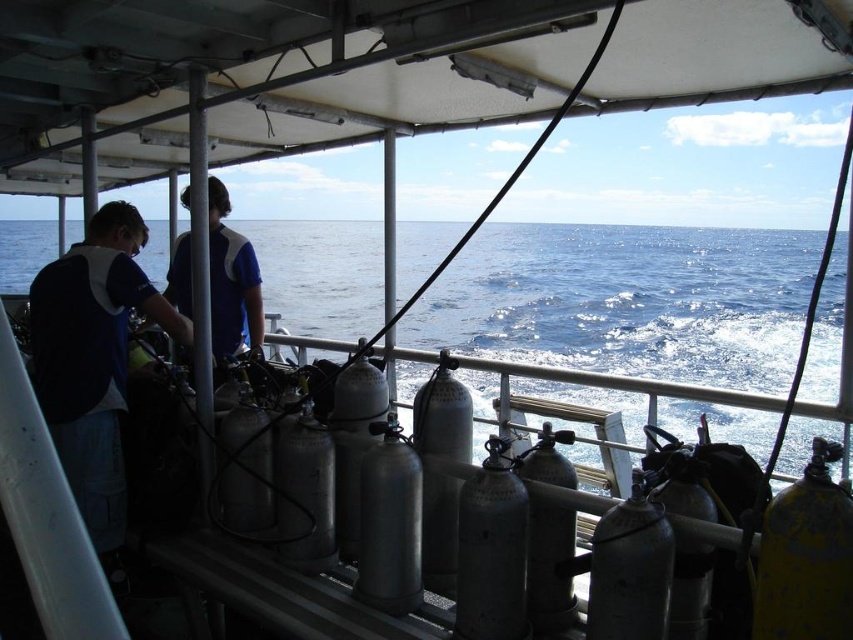
Question: Is dark blue shirt at left wider than blue fabric shirt at center?

Choices:
 (A) no
 (B) yes

Answer: (B)

Question: Does metallic silver water at lower center have a smaller size compared to blue fabric shirt at center?

Choices:
 (A) no
 (B) yes

Answer: (A)

Question: Is dark blue shirt at left positioned in front of blue fabric shirt at center?

Choices:
 (A) no
 (B) yes

Answer: (B)

Question: Which object is positioned farthest from the dark blue shirt at left?

Choices:
 (A) metallic silver water at lower center
 (B) blue fabric shirt at center

Answer: (A)

Question: Which object appears closest to the camera in this image?

Choices:
 (A) dark blue shirt at left
 (B) blue fabric shirt at center
 (C) metallic silver water at lower center

Answer: (C)

Question: Which of the following is the farthest from the observer?

Choices:
 (A) dark blue shirt at left
 (B) blue fabric shirt at center
 (C) metallic silver water at lower center

Answer: (B)